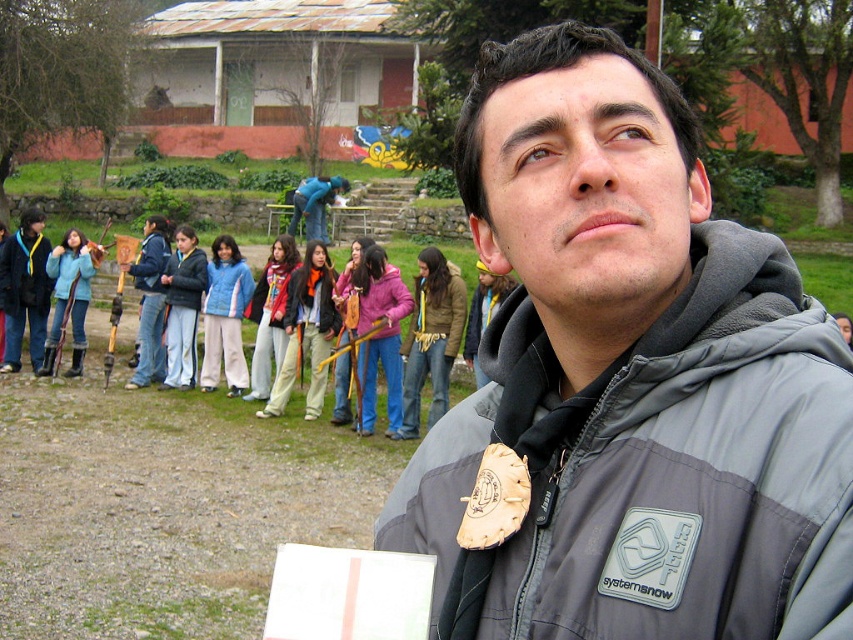
Is gray synthetic jacket at center to the right of blue fleece jacket at left from the viewer's perspective?

Yes, gray synthetic jacket at center is to the right of blue fleece jacket at left.

Does point (553, 634) lie behind point (144, 230)?

No, (553, 634) is in front of (144, 230).

Who is more distant from viewer, (782,278) or (154,246)?

The point (154,246) is more distant.

The height and width of the screenshot is (640, 853). Find the location of `gray synthetic jacket at center`. gray synthetic jacket at center is located at coordinates (654, 470).